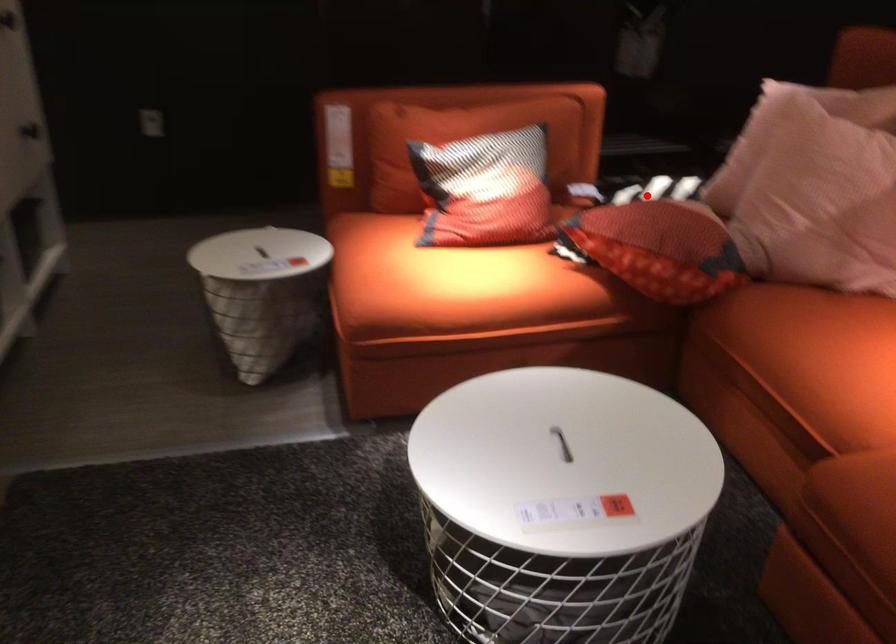
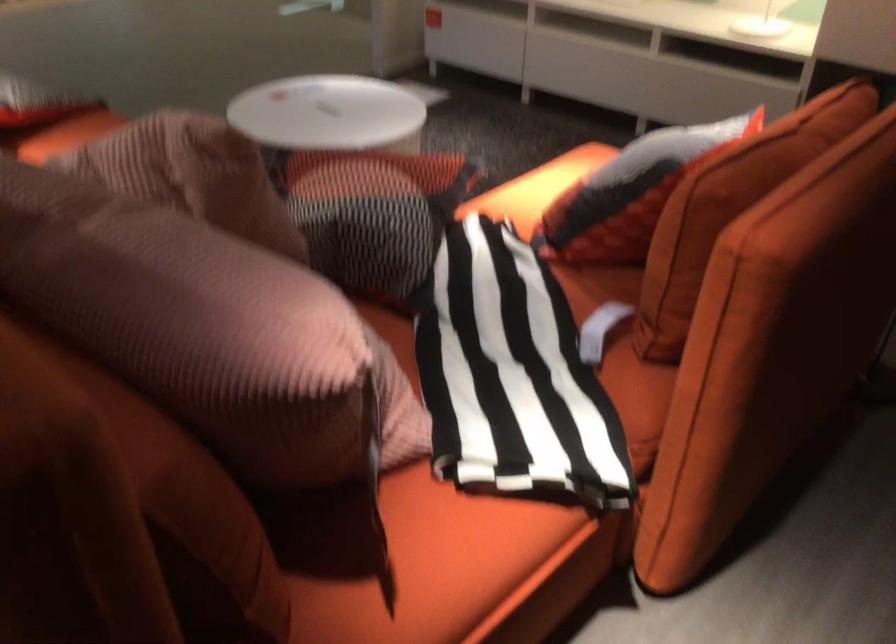
Question: I am providing you with two images of the same scene from different viewpoints. Image1 has a red point marked. In image2, the corresponding 3D location appears at what relative position? Reply with the corresponding letter.

Choices:
 (A) Closer
 (B) Farther

Answer: (A)